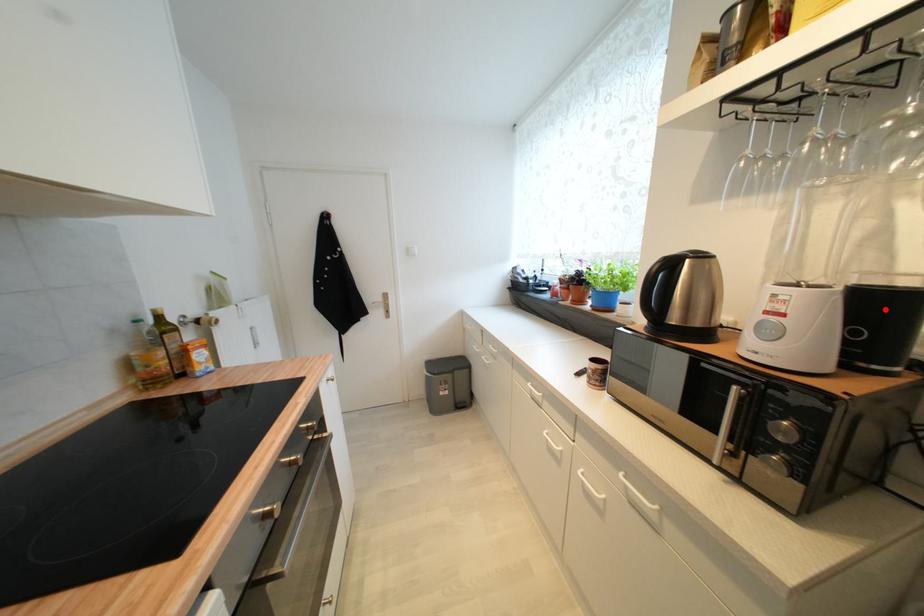
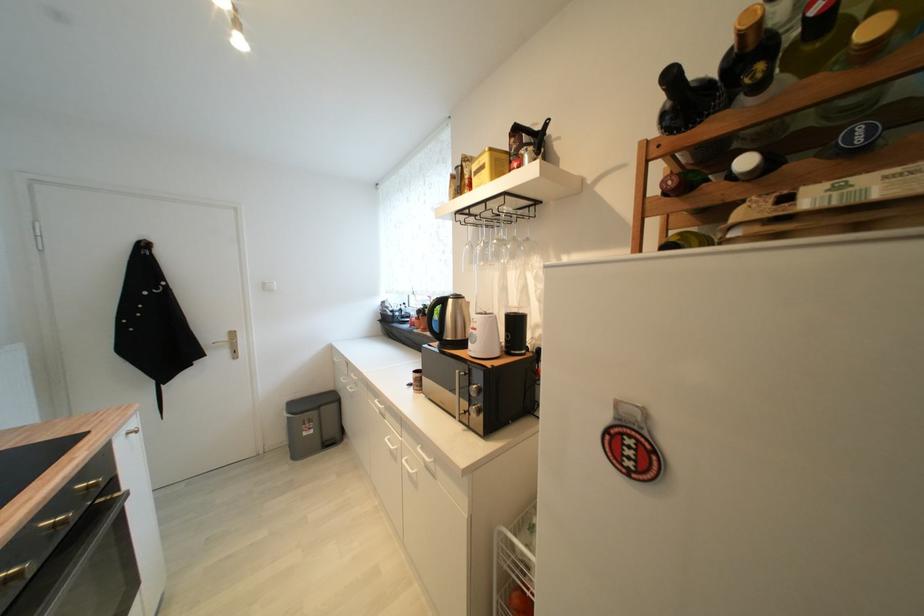
Locate, in the second image, the point that corresponds to the highlighted location in the first image.

(521, 325)